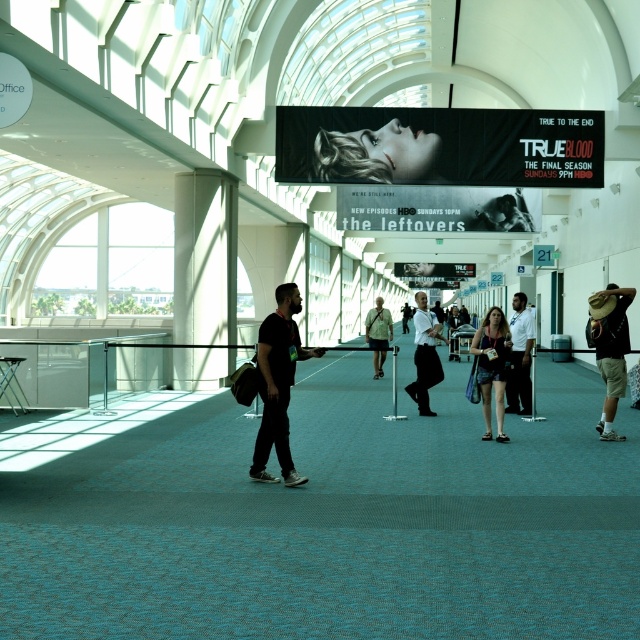
You are standing in the corridor and want to move from the point at coordinates [513,410] to the point at [422,330]. Will you be moving closer to or farther from the viewer as you travel between these points?

Moving from point [513,410] to point [422,330] means you will be moving farther from the viewer because point [513,410] is closer to the viewer than point [422,330].

You are a photographer standing in the corridor and you see two people in the center area wearing a black matte shirt at center and a denim dress at center. Which one is more to the left?

The black matte shirt at center is more to the left than the denim dress at center.